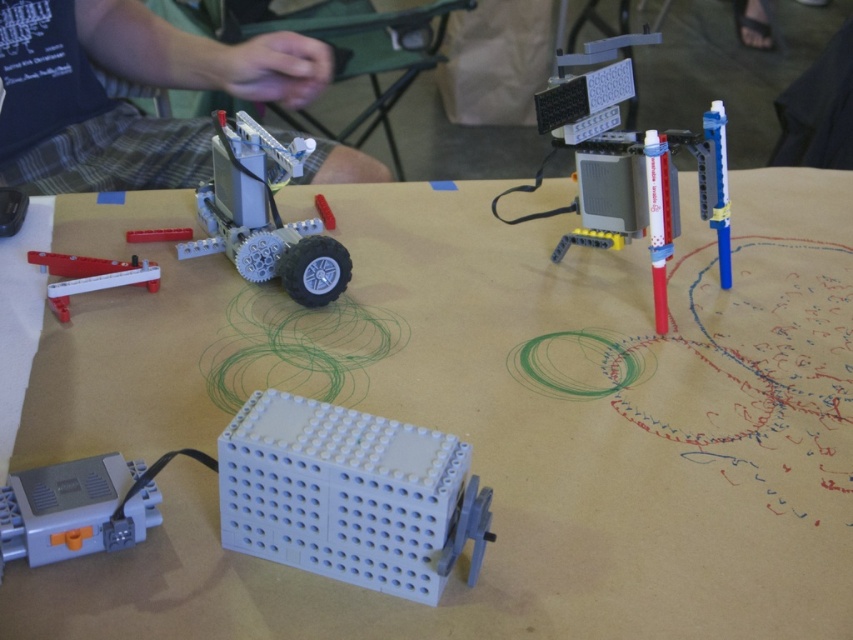
Question: Which point is closer to the camera?

Choices:
 (A) white plastic table at center
 (B) light blue plastic at center
 (C) translucent red pen at upper right

Answer: (B)

Question: Is translucent red pen at upper right wider than matte plastic rover at center-left?

Choices:
 (A) yes
 (B) no

Answer: (A)

Question: Is white plastic table at center to the right of gray plastic motor at lower left from the viewer's perspective?

Choices:
 (A) no
 (B) yes

Answer: (B)

Question: Estimate the real-world distances between objects in this image. Which object is farther from the white plastic table at center?

Choices:
 (A) matte plastic rover at center-left
 (B) light blue plastic at center
 (C) white plastic lever at left
 (D) gray plastic motor at lower left

Answer: (D)

Question: Can you confirm if light blue plastic at center is wider than gray plastic motor at lower left?

Choices:
 (A) no
 (B) yes

Answer: (B)

Question: Which point is closer to the camera taking this photo?

Choices:
 (A) (151, 480)
 (B) (247, 276)

Answer: (A)